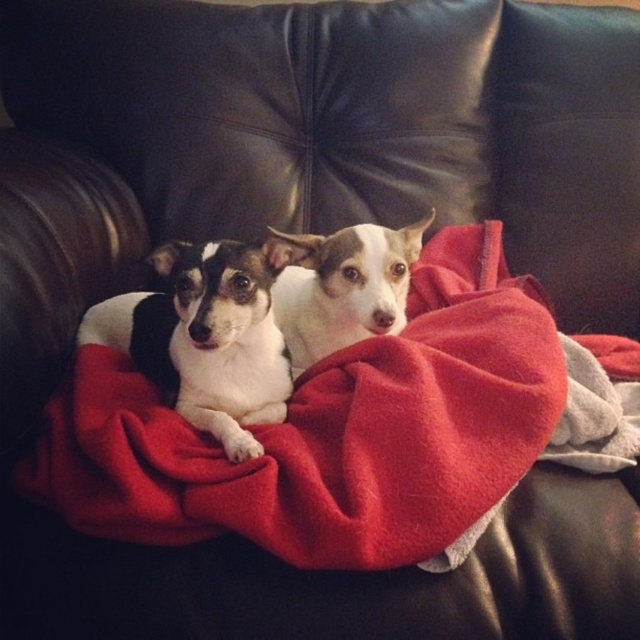
Question: Which of the following is the closest to the observer?

Choices:
 (A) (168, 352)
 (B) (456, 236)

Answer: (A)

Question: Among these points, which one is nearest to the camera?

Choices:
 (A) [243, 456]
 (B) [321, 262]
 (C) [529, 310]

Answer: (A)

Question: Is red fleece blanket at center further to camera compared to black-and-white fur dog at center?

Choices:
 (A) no
 (B) yes

Answer: (A)

Question: Does black-and-white fur dog at center appear on the right side of white fur dog at center?

Choices:
 (A) no
 (B) yes

Answer: (A)

Question: Among these points, which one is nearest to the camera?

Choices:
 (A) (276, 305)
 (B) (493, 435)
 (C) (154, 262)

Answer: (B)

Question: Is black-and-white fur dog at center smaller than white fur dog at center?

Choices:
 (A) yes
 (B) no

Answer: (A)